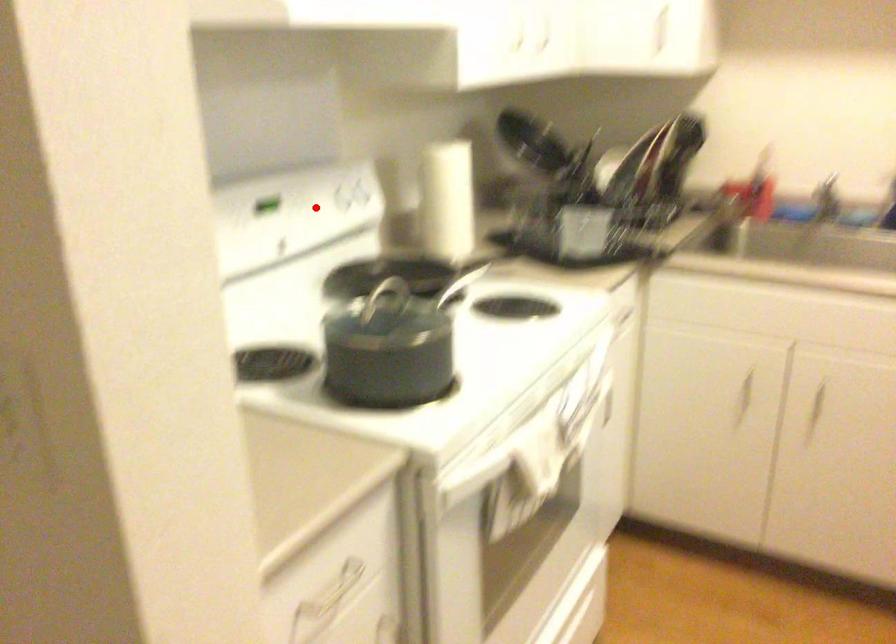
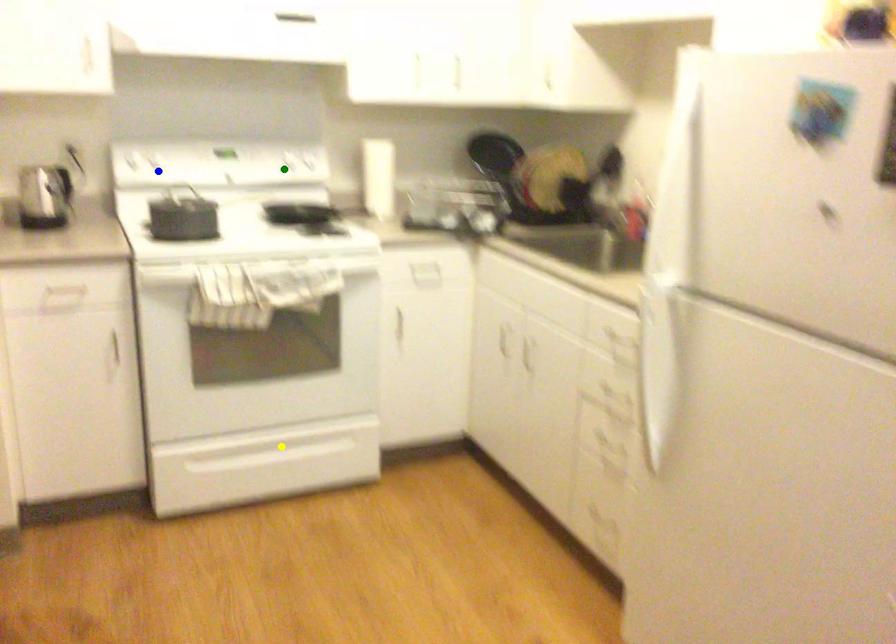
Question: I am providing you with two images of the same scene from different viewpoints. A red point is marked on the first image. You are given multiple points on the second image. Which spot in image 2 lines up with the point in image 1?

Choices:
 (A) green point
 (B) yellow point
 (C) blue point

Answer: (A)